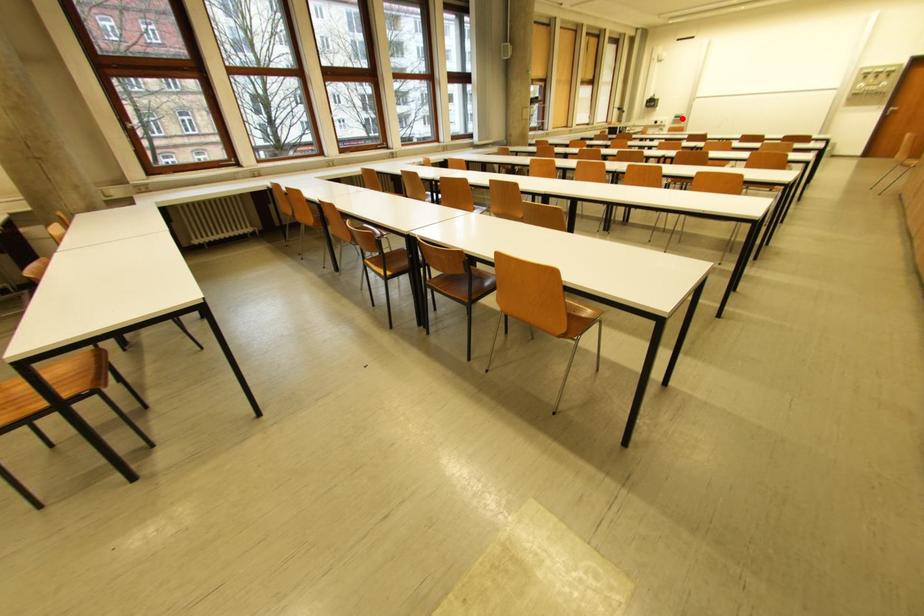
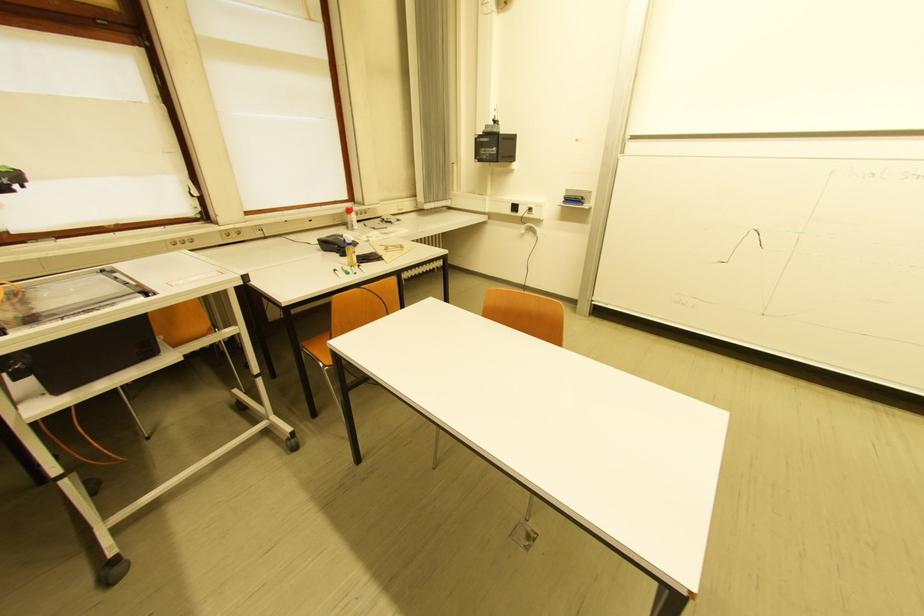
Find the pixel in the second image that matches the highlighted location in the first image.

(575, 201)